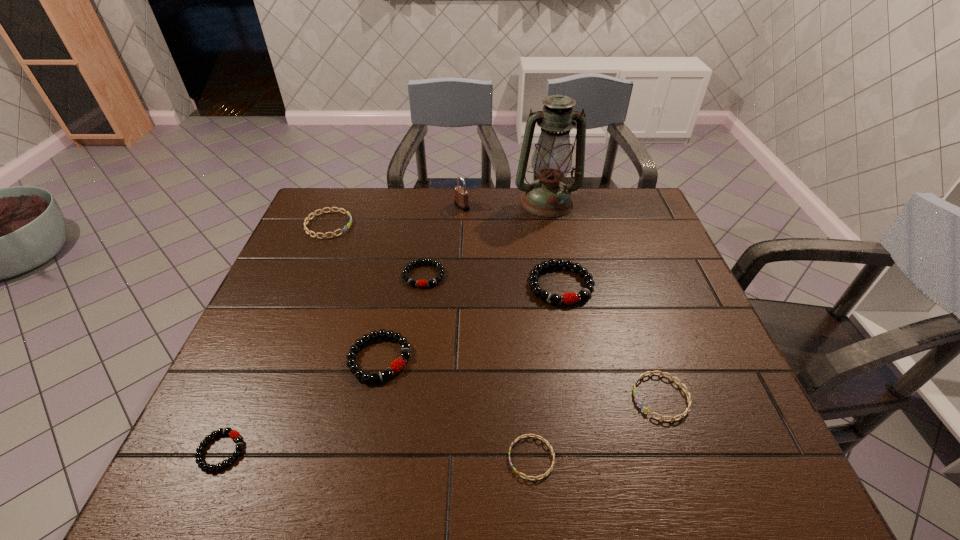
The image size is (960, 540). What are the coordinates of `the rightmost blue bracelet` in the screenshot? It's located at (646, 410).

Locate an element on the screen. The height and width of the screenshot is (540, 960). the leftmost black bracelet is located at coordinates pyautogui.click(x=233, y=434).

Find the location of a particular element. the smallest black bracelet is located at coordinates (233, 434).

The image size is (960, 540). I want to click on the second blue bracelet from right to left, so click(525, 435).

Locate an element on the screen. the smallest blue bracelet is located at coordinates coord(525,435).

The width and height of the screenshot is (960, 540). What are the coordinates of `free point located 0.120m on the right of the oil lamp` in the screenshot? It's located at (615, 202).

You are a GUI agent. You are given a task and a screenshot of the screen. Output one action in this format:
    pyautogui.click(x=<x>, y=<y>)
    Task: Click on the vacant space located 0.200m on the front of the fifth object from left to right
    
    Given the screenshot: What is the action you would take?
    pyautogui.click(x=460, y=250)

Find the location of a particular element. The image size is (960, 540). free space located 0.220m on the left of the seventh shortest object is located at coordinates (447, 285).

Locate an element on the screen. This screenshot has width=960, height=540. vacant point located 0.180m on the left of the second nearest black bracelet is located at coordinates (271, 358).

Where is `vacant space situated on the surface of the leftmost blue bracelet showing star-shaped elements`? Image resolution: width=960 pixels, height=540 pixels. vacant space situated on the surface of the leftmost blue bracelet showing star-shaped elements is located at coordinates (466, 225).